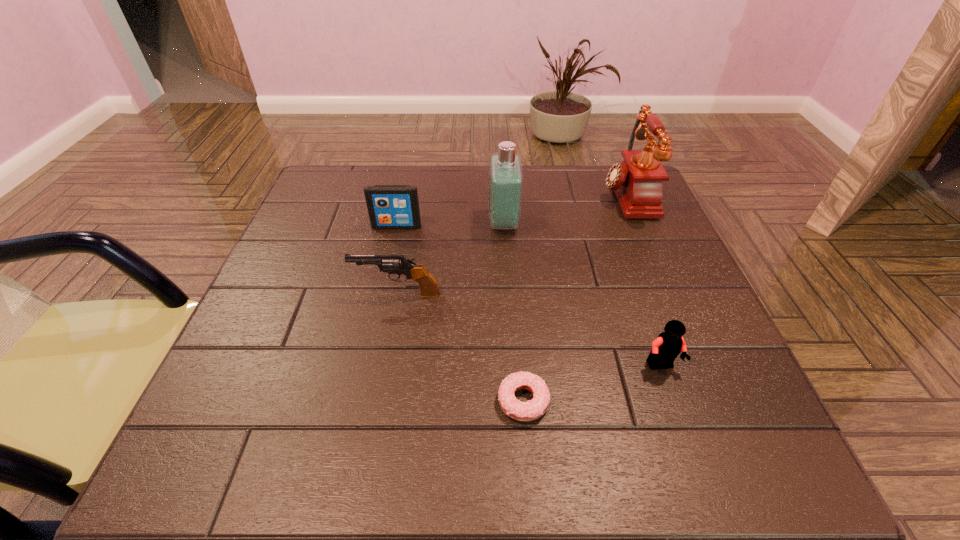
I want to click on free location at the near left corner, so click(186, 460).

Find the location of a particular element. Image resolution: width=960 pixels, height=540 pixels. vacant space at the near right corner of the desktop is located at coordinates (723, 470).

Identify the location of unoccupied area between the iPod and the Lego. This screenshot has width=960, height=540. (529, 296).

The image size is (960, 540). Identify the location of vacant area that lies between the doughnut and the second nearest object. (592, 383).

Locate an element on the screen. Image resolution: width=960 pixels, height=540 pixels. vacant space in between the nearest object and the perfume is located at coordinates pyautogui.click(x=514, y=312).

At what (x,y) coordinates should I click in order to perform the action: click on vacant space that is in between the iPod and the second nearest object. Please return your answer as a coordinate pair (x, y). This screenshot has width=960, height=540. Looking at the image, I should click on (529, 296).

I want to click on vacant space that is in between the perfume and the doughnut, so click(514, 312).

Where is `free space between the nearest object and the perfume`? Image resolution: width=960 pixels, height=540 pixels. free space between the nearest object and the perfume is located at coordinates (514, 312).

The width and height of the screenshot is (960, 540). I want to click on vacant space in between the doughnut and the iPod, so click(460, 314).

Identify which object is located as the fifth nearest to the nearest object. Please provide its 2D coordinates. Your answer should be formatted as a tuple, i.e. [(x, y)], where the tuple contains the x and y coordinates of a point satisfying the conditions above.

[(637, 182)]